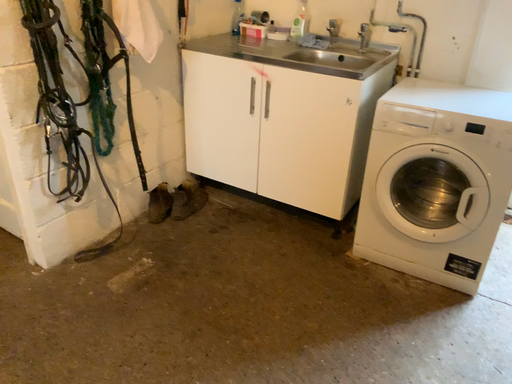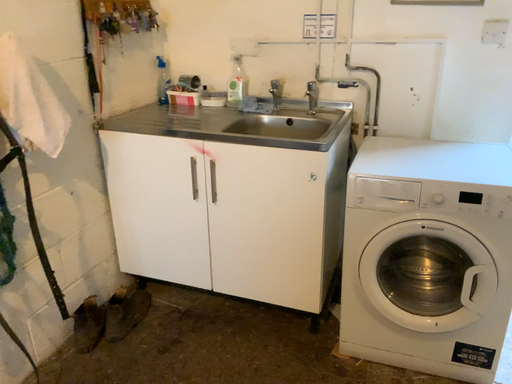
Question: Which way did the camera rotate in the video?

Choices:
 (A) rotated left
 (B) rotated right

Answer: (B)